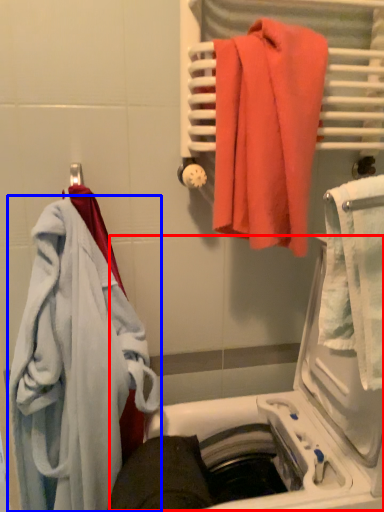
Question: Which object is further to the camera taking this photo, dish washer (highlighted by a red box) or towel (highlighted by a blue box)?

Choices:
 (A) dish washer
 (B) towel

Answer: (B)